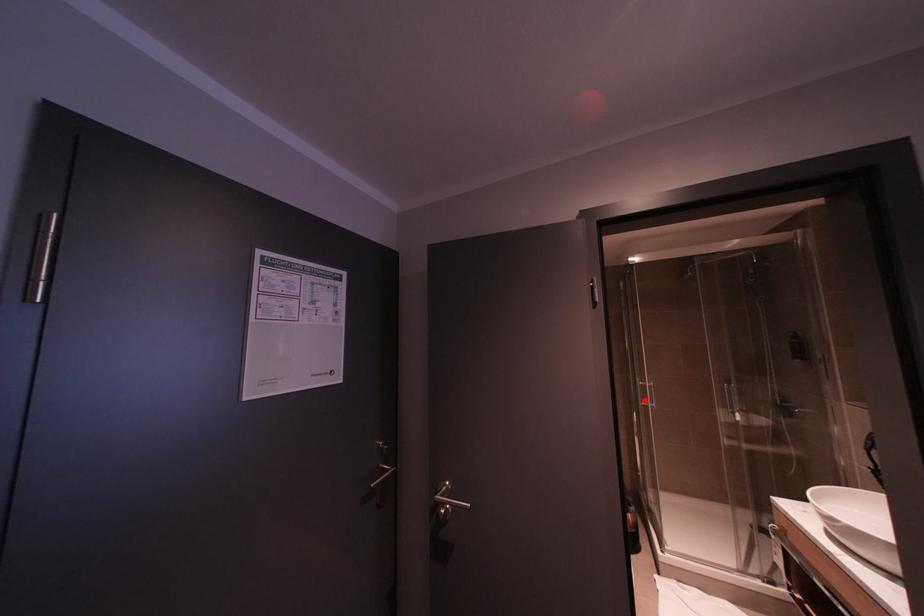
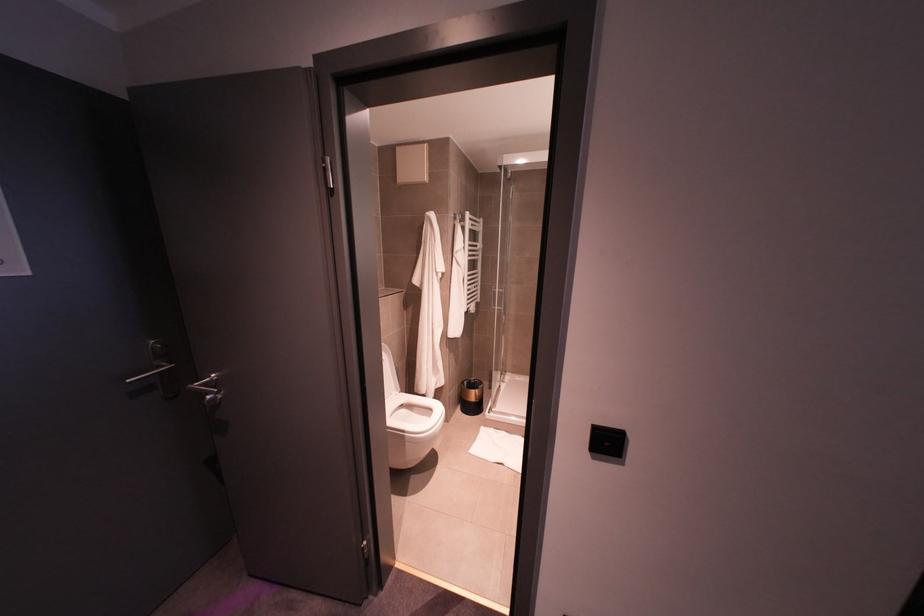
Locate, in the second image, the point that corresponds to the highlighted location in the first image.

(494, 305)